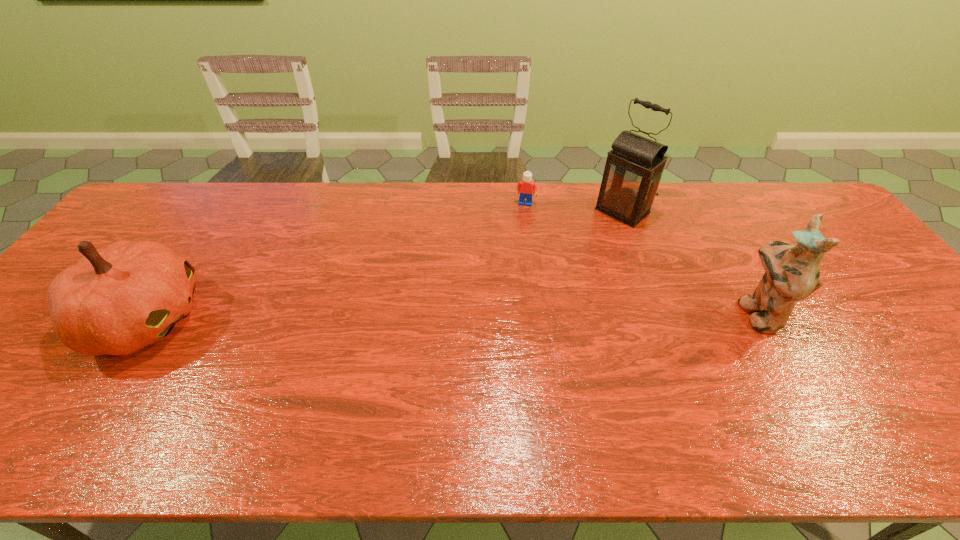
Where is `the leftmost object`? the leftmost object is located at coordinates (116, 300).

Where is `the second shortest object`? The image size is (960, 540). the second shortest object is located at coordinates (116, 300).

At what (x,y) coordinates should I click in order to perform the action: click on the rightmost object. Please return your answer as a coordinate pair (x, y). This screenshot has width=960, height=540. Looking at the image, I should click on (792, 273).

The image size is (960, 540). In order to click on Lego in this screenshot , I will do pos(525,187).

Find the location of a particular element. the second object from left to right is located at coordinates (525, 187).

You are a GUI agent. You are given a task and a screenshot of the screen. Output one action in this format:
    pyautogui.click(x=<x>, y=<y>)
    Task: Click on the lantern
    The image size is (960, 540).
    Given the screenshot: What is the action you would take?
    pyautogui.click(x=633, y=170)

Locate an element on the screen. Image resolution: width=960 pixels, height=540 pixels. the tallest object is located at coordinates (633, 170).

Where is `vacant space located on the front-facing side of the leftmost object`? The image size is (960, 540). vacant space located on the front-facing side of the leftmost object is located at coordinates (314, 319).

The height and width of the screenshot is (540, 960). Identify the location of free location located on the front-facing side of the figurine. (594, 313).

The image size is (960, 540). Find the location of `vacant space located on the front-facing side of the figurine`. vacant space located on the front-facing side of the figurine is located at coordinates (700, 313).